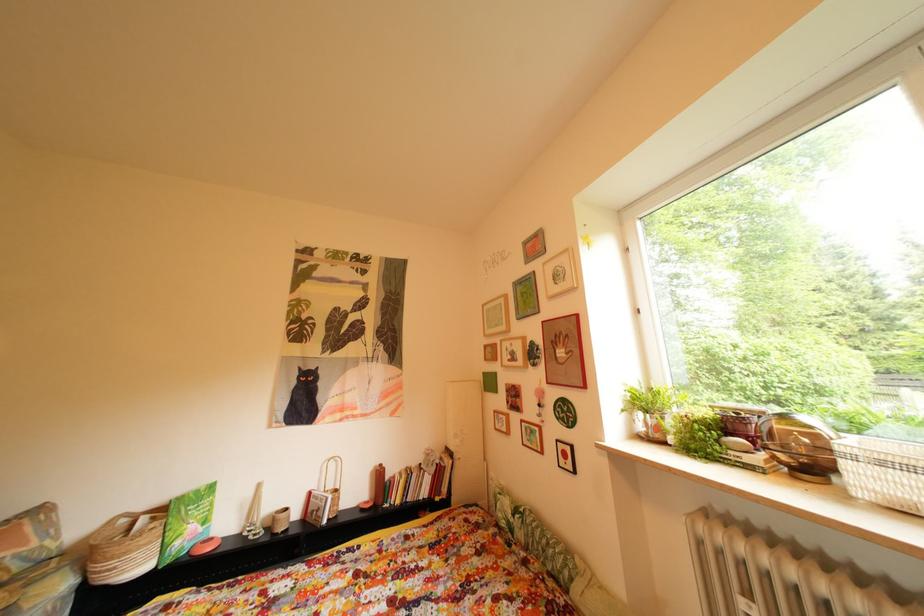
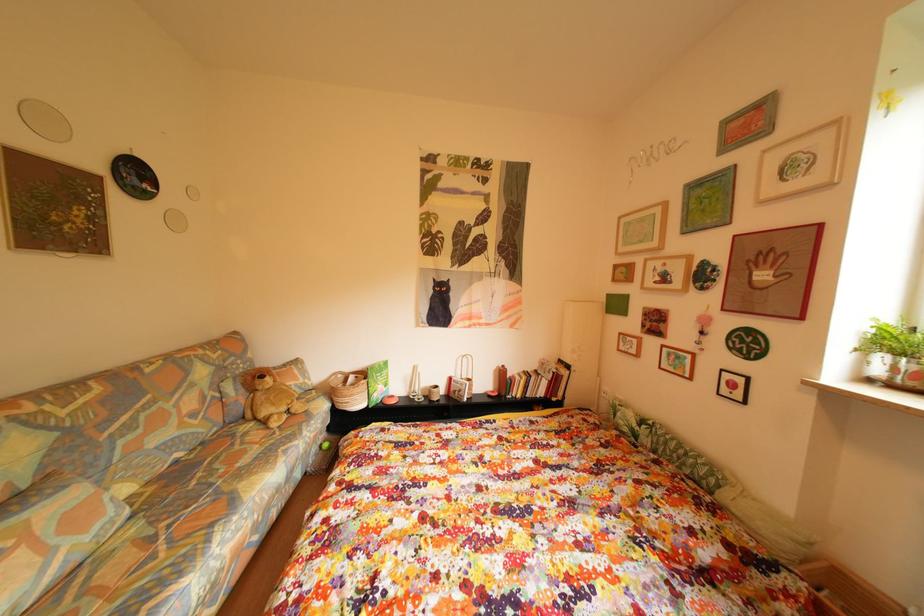
Question: The images are taken continuously from a first-person perspective. In which direction are you moving?

Choices:
 (A) Left
 (B) Right
 (C) Forward
 (D) Backward

Answer: (A)